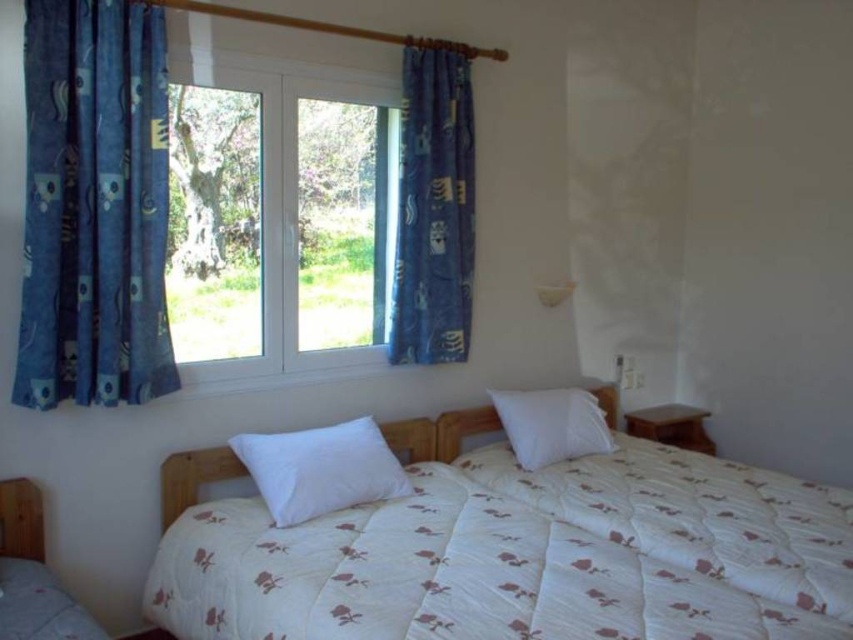
You are standing in the bedroom and want to determine which of the two points, point (589, 474) or point (515, 394), is nearer to you. Based on the scene description, which point is closer?

Point (589, 474) is closer to the viewer than point (515, 394).

You are a delivery person who just placed a small package on the nightstand. The package is 10 inches long. You need to move it to the bed without moving the quilt or the pillow. Is there enough space between the white quilted blanket at center and the white soft pillow at upper right to place the package horizontally?

The white quilted blanket at center and the white soft pillow at upper right are 12.78 inches apart from each other. Since the package is 10 inches long, there is enough space to place it horizontally between them without moving the quilt or the pillow.

You are arranging a bed in a cozy bedroom. You have a white quilted blanket at center and a white soft pillow at center. Which item is shorter in height?

The white quilted blanket at center is shorter in height compared to the white soft pillow at center.